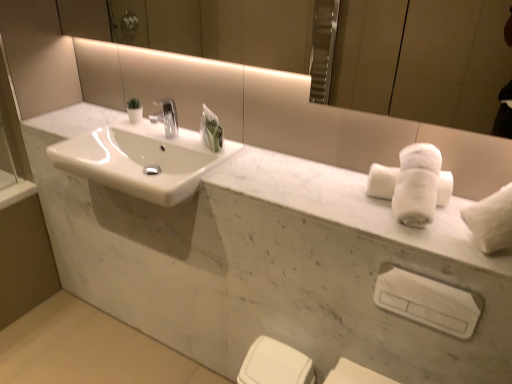
Question: Would you say white marble sink at center is inside or outside white glossy porcelain at lower center, marked as the second porcelain in a top-to-bottom arrangement?

Choices:
 (A) inside
 (B) outside

Answer: (B)

Question: Visually, is white marble sink at center positioned to the left or to the right of white glossy porcelain at lower center, marked as the second porcelain in a top-to-bottom arrangement?

Choices:
 (A) right
 (B) left

Answer: (B)

Question: Based on their relative distances, which object is farther from the white glossy porcelain at lower center, marked as the second porcelain in a top-to-bottom arrangement?

Choices:
 (A) smooth concrete floor at lower left
 (B) white marble sink at center, the 1th porcelain positioned from the top
 (C) white marble sink at center
 (D) white fluffy bath towel at right
 (E) white plastic towel bar at lower right

Answer: (C)

Question: Estimate the real-world distances between objects in this image. Which object is closer to the white glossy porcelain at lower center, marked as the second porcelain in a top-to-bottom arrangement?

Choices:
 (A) white plastic towel bar at lower right
 (B) white marble sink at center
 (C) white fluffy bath towel at right
 (D) smooth concrete floor at lower left
 (E) white marble sink at center, the 1th porcelain positioned from the top

Answer: (E)